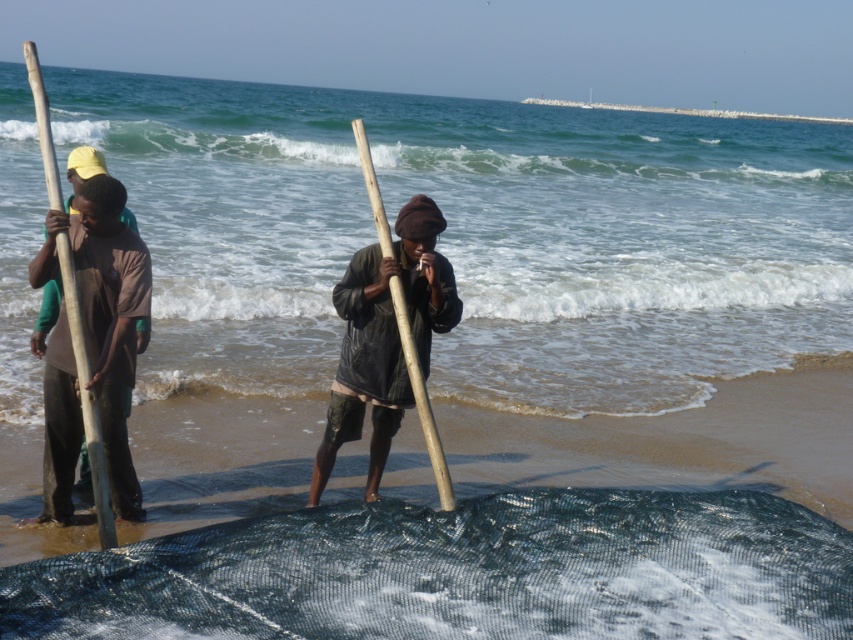
Question: Observing the image, what is the correct spatial positioning of clear blue water at center in reference to wooden stick at center?

Choices:
 (A) right
 (B) left

Answer: (B)

Question: Considering the real-world distances, which object is closest to the wooden paddle at left?

Choices:
 (A) wooden stick at center
 (B) clear blue water at center
 (C) black mesh net at lower center

Answer: (C)

Question: Among these points, which one is nearest to the camera?

Choices:
 (A) (721, 508)
 (B) (579, 118)
 (C) (415, 388)

Answer: (C)

Question: Can you confirm if clear blue water at center is bigger than wooden paddle at left?

Choices:
 (A) no
 (B) yes

Answer: (B)

Question: From the image, what is the correct spatial relationship of black mesh net at lower center in relation to wooden stick at center?

Choices:
 (A) below
 (B) above

Answer: (A)

Question: Among these points, which one is farthest from the camera?

Choices:
 (A) (312, 221)
 (B) (74, 292)
 (C) (746, 627)
 (D) (357, 141)

Answer: (A)